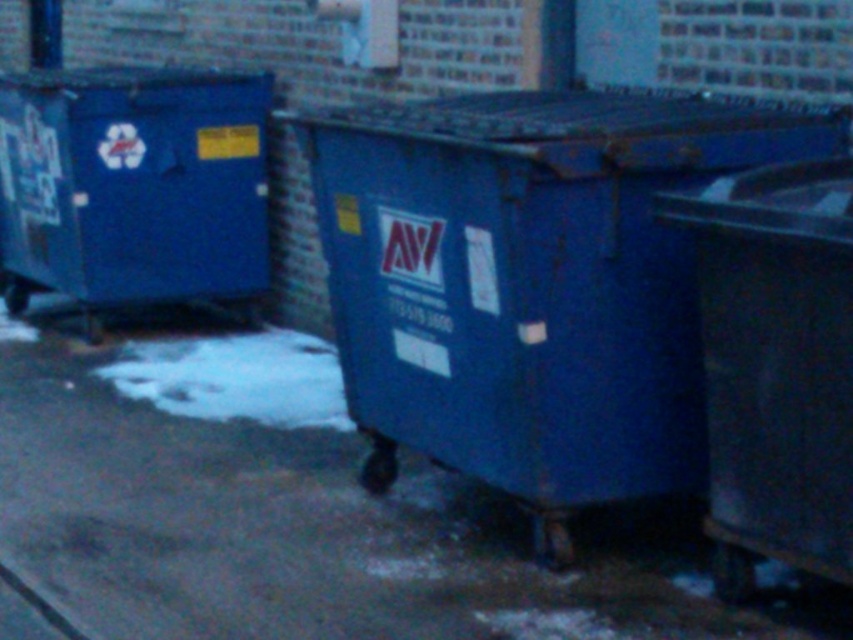
You are standing at the point with coordinates point [12,269] and want to walk towards the brick wall in the background. Will you pass by the point with coordinates point [752,451] along the way?

Yes, because point [752,451] is in front of point [12,269], so walking towards the brick wall would require passing through point [752,451].

Based on the photo, you are a delivery person with a heavy box that needs to be placed near the slick asphalt pavement at center and the rusty metal dumpster at right. The box is 1.5 meters long. Can you place the box horizontally between them without it overlapping either object?

The distance between the slick asphalt pavement at center and the rusty metal dumpster at right is 1.53 meters. Since the box is 1.5 meters long, it can fit horizontally between them without overlapping either object.